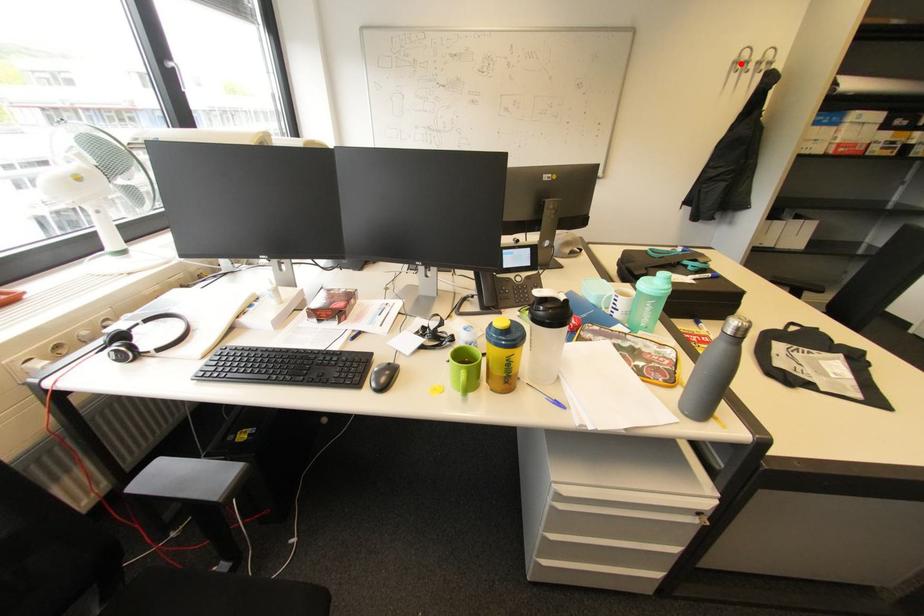
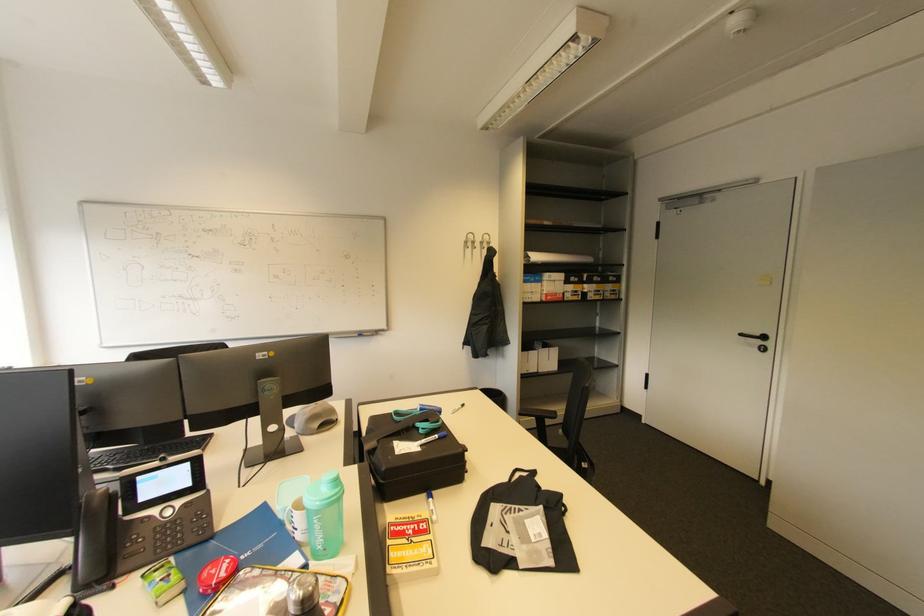
In the second image, find the point that corresponds to the highlighted location in the first image.

(470, 243)